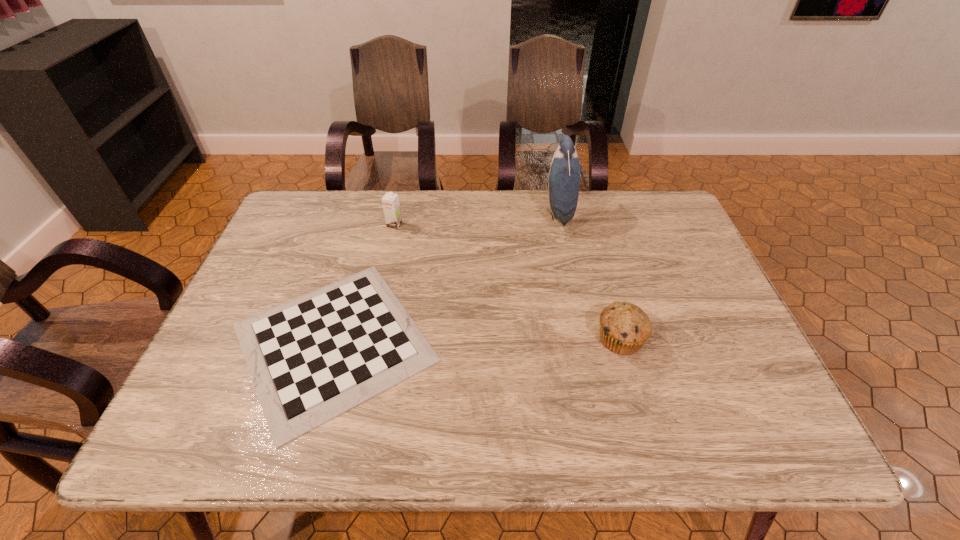
Where is `free spot at the near right corner of the desktop`? free spot at the near right corner of the desktop is located at coordinates (704, 415).

I want to click on free space between the shortest object and the muffin, so click(477, 340).

Where is `free space between the muffin and the bird`? free space between the muffin and the bird is located at coordinates (589, 276).

Where is `vacant area that lies between the muffin and the tallest object`? vacant area that lies between the muffin and the tallest object is located at coordinates click(x=589, y=276).

Find the location of a particular element. The height and width of the screenshot is (540, 960). free space between the muffin and the bird is located at coordinates 589,276.

This screenshot has height=540, width=960. Identify the location of empty location between the chocolate milk and the bird. (476, 219).

Where is `vacant region between the tallest object and the chessboard`? The width and height of the screenshot is (960, 540). vacant region between the tallest object and the chessboard is located at coordinates (445, 278).

Find the location of `unoccupied area between the muffin and the bird`. unoccupied area between the muffin and the bird is located at coordinates (589, 276).

This screenshot has width=960, height=540. What are the coordinates of `free spot between the muffin and the chessboard` in the screenshot? It's located at [477, 340].

The height and width of the screenshot is (540, 960). I want to click on object that is the closest to the muffin, so click(x=564, y=175).